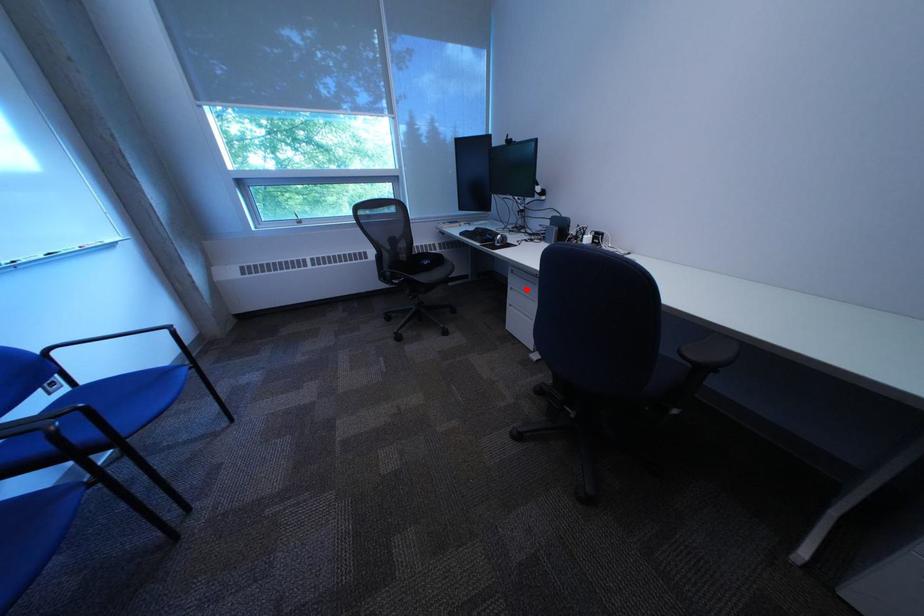
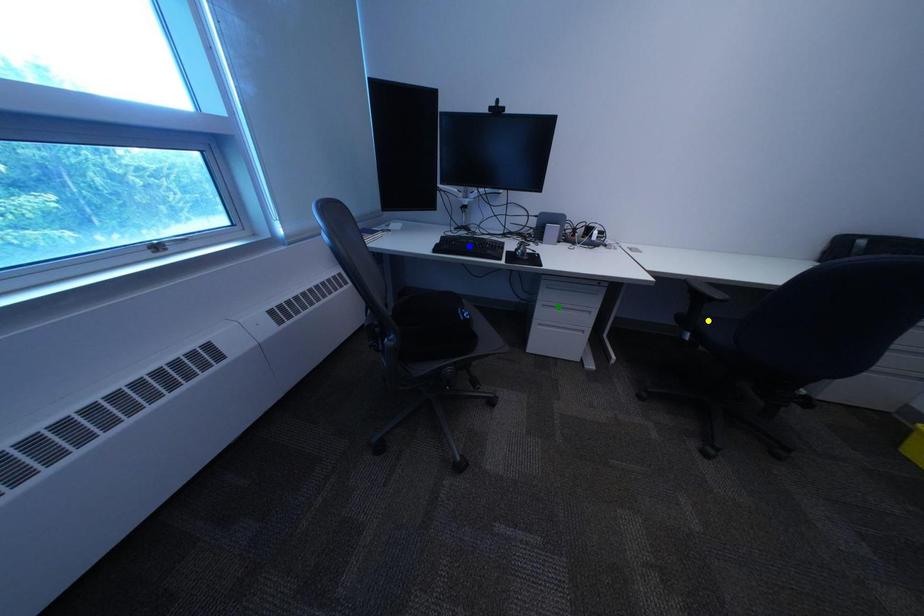
Question: I am providing you with two images of the same scene from different viewpoints. A red point is marked on the first image. You are given multiple points on the second image. In image 2, which mark is for the same physical point as the one in image 1?

Choices:
 (A) blue point
 (B) yellow point
 (C) green point

Answer: (C)